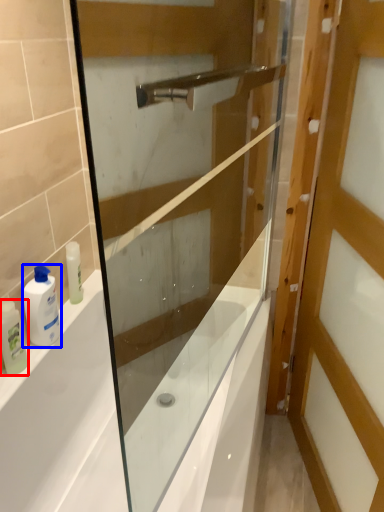
Question: Which point is further to the camera, toiletry (highlighted by a red box) or toiletry (highlighted by a blue box)?

Choices:
 (A) toiletry
 (B) toiletry

Answer: (B)